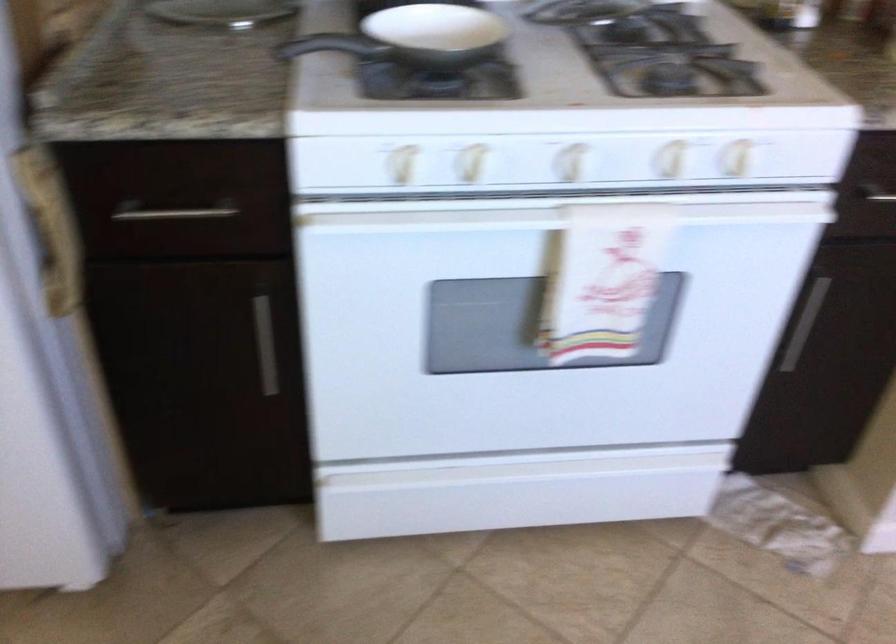
The width and height of the screenshot is (896, 644). Identify the location of oven door handle. (550, 218).